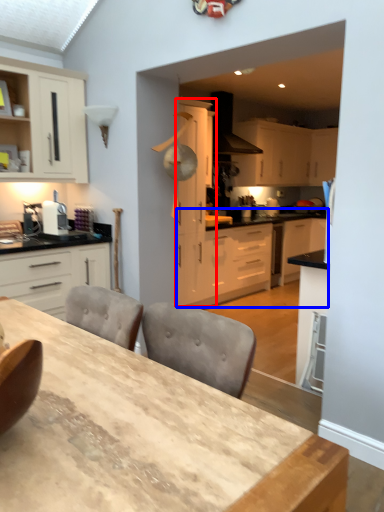
Question: Which object is closer to the camera taking this photo, cabinetry (highlighted by a red box) or counter (highlighted by a blue box)?

Choices:
 (A) cabinetry
 (B) counter

Answer: (A)